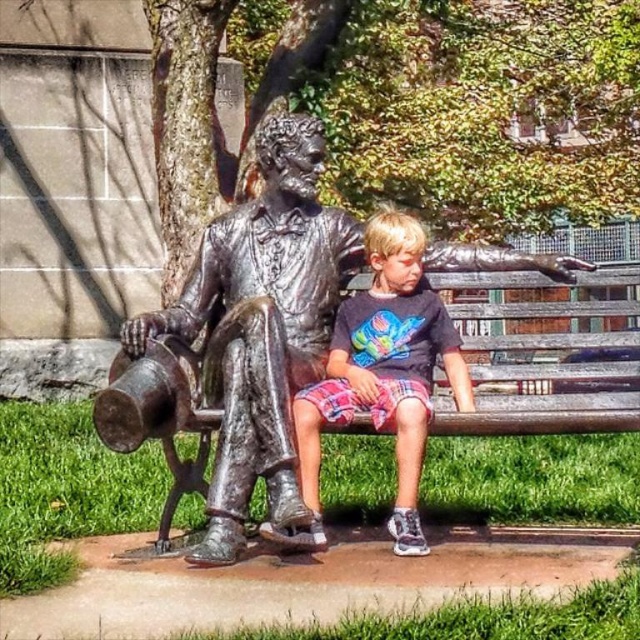
You are standing in the park and want to take a photo of the bronze statue at center. If you are currently 3.25 meters away from it, is that close enough to capture the entire statue in your camera frame?

The bronze statue at center is 3.25 meters away from the viewer, so yes, capturing the entire statue in the camera frame is possible from that distance.

You are a park visitor trying to take a photo of the bronze statue at center and the matte black shirt at center from a distance. Which object will appear wider in the photo?

The bronze statue at center will appear wider in the photo because its width surpasses that of the matte black shirt at center.

You are standing in the park and see two points marked in the image. The first point is at coordinates point (134, 429) and the second point is at point (376, 321). Which point is closer to you?

Point (134, 429) is in front of point (376, 321), so the first point is closer to you.